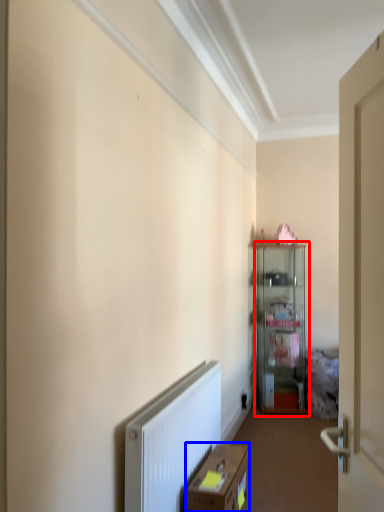
Question: Which object appears closest to the camera in this image, cabinetry (highlighted by a red box) or cardboard box (highlighted by a blue box)?

Choices:
 (A) cabinetry
 (B) cardboard box

Answer: (B)